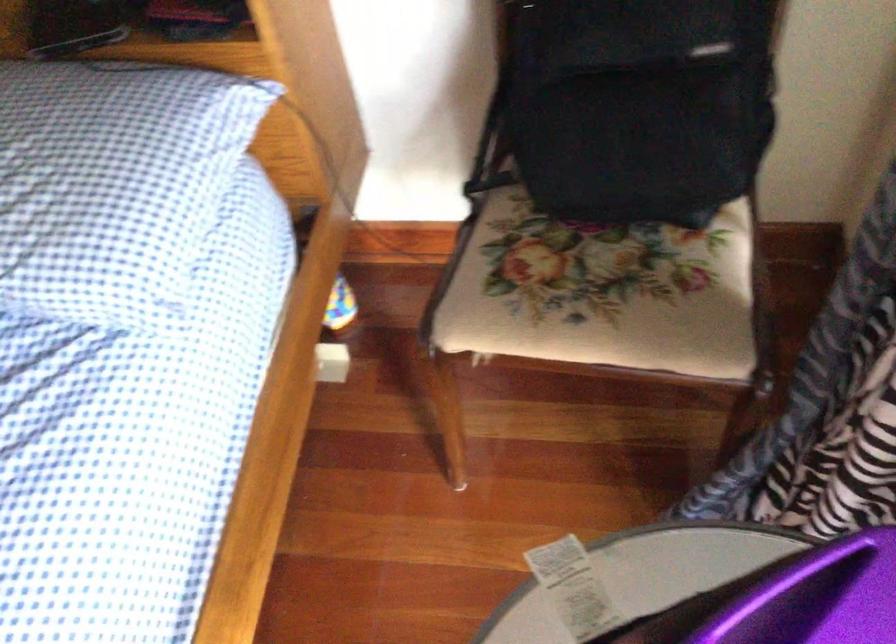
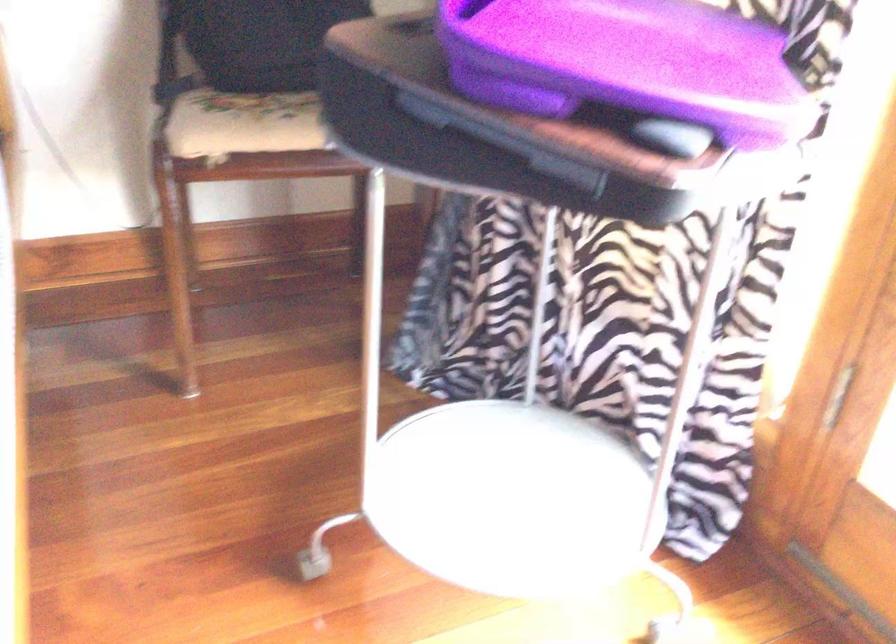
Consider the image. The first image is from the beginning of the video and the second image is from the end. How did the camera likely rotate when shooting the video?

The rotation direction of the camera is right-up.